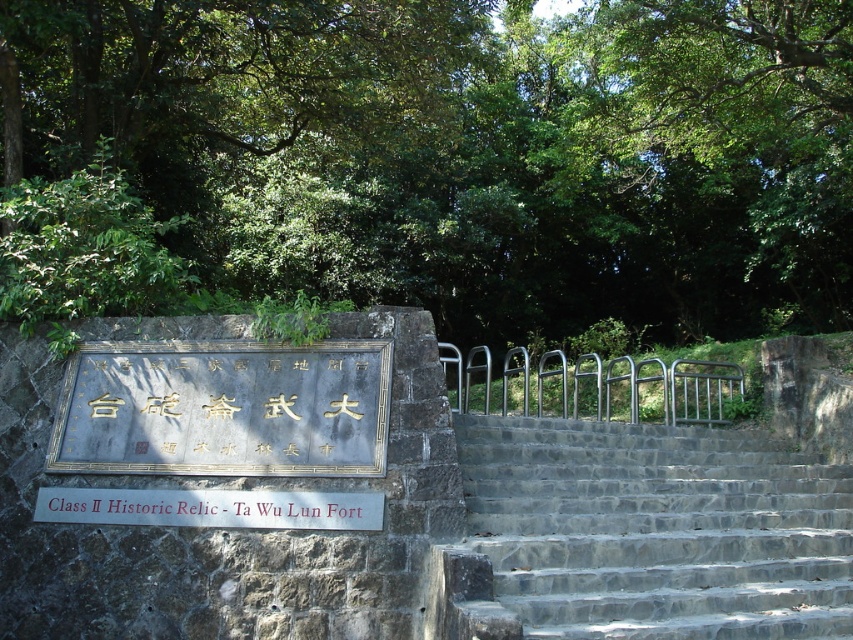
Which of these two, gray stone stairs at center or white wooden sign at center, stands shorter?

Standing shorter between the two is white wooden sign at center.

Is point (717, 608) positioned after point (312, 506)?

No.

Where is `gray stone stairs at center`? The image size is (853, 640). gray stone stairs at center is located at coordinates pyautogui.click(x=657, y=529).

Is goldmaterial/textureplaque at center wider than white wooden sign at center?

Yes, goldmaterial/textureplaque at center is wider than white wooden sign at center.

What do you see at coordinates (224, 408) in the screenshot? The height and width of the screenshot is (640, 853). I see `goldmaterial/textureplaque at center` at bounding box center [224, 408].

Between point (326, 372) and point (76, 520), which one is positioned behind?

The point (326, 372) is behind.

The height and width of the screenshot is (640, 853). What are the coordinates of `goldmaterial/textureplaque at center` in the screenshot? It's located at (224, 408).

Does green leafy tree at upper center lie in front of goldmaterial/textureplaque at center?

No.

Is green leafy tree at upper center positioned at the back of goldmaterial/textureplaque at center?

Yes, green leafy tree at upper center is further from the viewer.

Between point (494, 195) and point (368, 428), which one is positioned in front?

Point (368, 428)

Image resolution: width=853 pixels, height=640 pixels. Find the location of `green leafy tree at upper center`. green leafy tree at upper center is located at coordinates (434, 163).